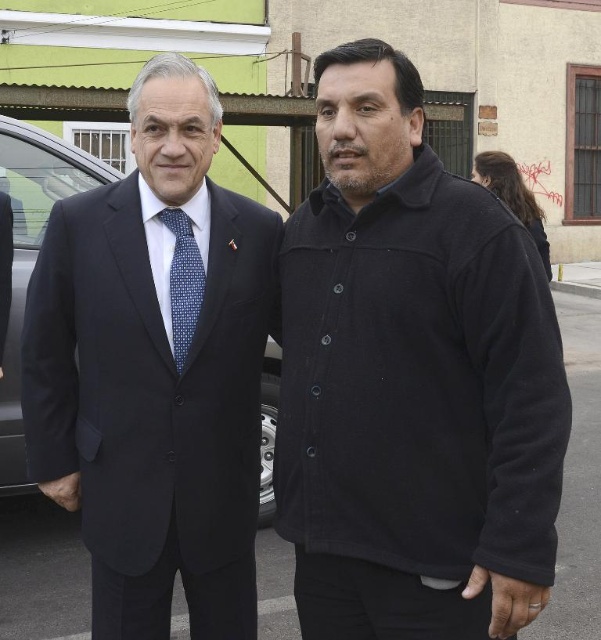
You are a photographer trying to capture a closeup of the matte black suit at left. Based on its coordinates, where should you aim your camera?

The matte black suit at left is located at coordinates point 0.578 on the x axis and point 0.260 on the y axis.

You are a photographer trying to capture a photo of the dark blue fabric car at left and the blue dotted tie at center. From your current position, which object is higher in the frame?

The dark blue fabric car at left is located above the blue dotted tie at center, so it is higher in the frame.

You are a photographer adjusting your camera settings to focus on two points in the scene. The first point is point (331,138) and the second is point (177,305). Which point should you focus on first if you want to capture the closest object to the camera?

You should focus on point (331,138) first because it is closer to the camera than point (177,305).